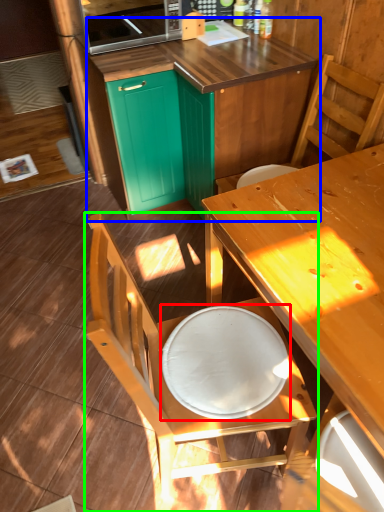
Question: Based on their relative distances, which object is farther from round table (highlighted by a red box)? Choose from cabinetry (highlighted by a blue box) and chair (highlighted by a green box).

Choices:
 (A) cabinetry
 (B) chair

Answer: (A)